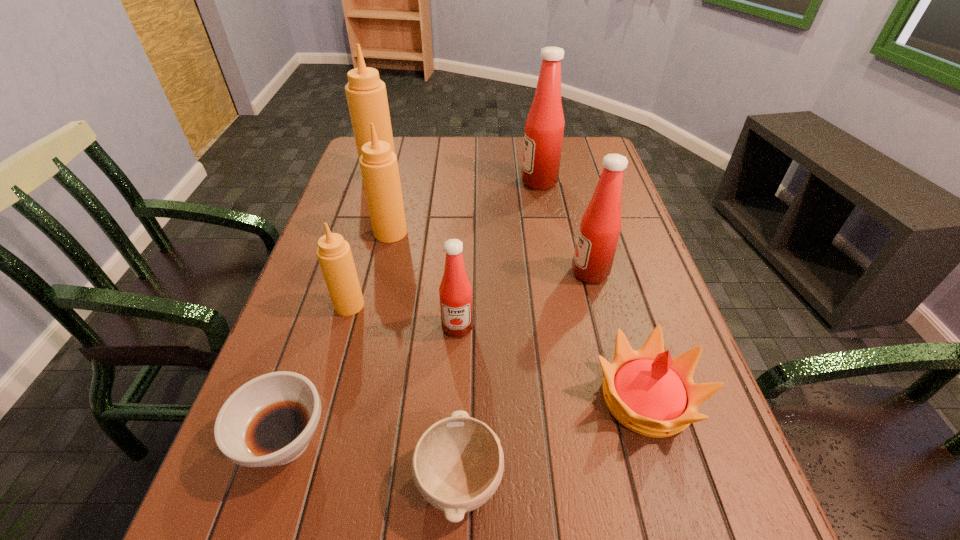
Locate an element on the screen. The width and height of the screenshot is (960, 540). vacant point located between the farthest tan condiment and the leftmost red condiment is located at coordinates (419, 251).

At what (x,y) coordinates should I click in order to perform the action: click on free space between the biggest red condiment and the beige bowl. Please return your answer as a coordinate pair (x, y). Image resolution: width=960 pixels, height=540 pixels. Looking at the image, I should click on (499, 330).

The width and height of the screenshot is (960, 540). What are the coordinates of `vacant area that lies between the beige bowl and the second farthest tan condiment` in the screenshot? It's located at (425, 356).

Find the location of a particular element. The image size is (960, 540). free space that is in between the farthest red condiment and the yellow crown is located at coordinates (x=592, y=290).

Where is `free point between the soup bowl and the second smallest red condiment`? free point between the soup bowl and the second smallest red condiment is located at coordinates (438, 356).

Identify which object is located as the fifth nearest to the farthest red condiment. Please provide its 2D coordinates. Your answer should be formatted as a tuple, i.e. [(x, y)], where the tuple contains the x and y coordinates of a point satisfying the conditions above.

[(334, 254)]

Where is `object that is the eighth nearest to the sixth nearest object`? object that is the eighth nearest to the sixth nearest object is located at coordinates (366, 94).

Where is `the closest condiment to the farthest red condiment`? the closest condiment to the farthest red condiment is located at coordinates (600, 227).

Choose which condiment is the third nearest neighbor to the nearest tan condiment. Please provide its 2D coordinates. Your answer should be formatted as a tuple, i.e. [(x, y)], where the tuple contains the x and y coordinates of a point satisfying the conditions above.

[(366, 94)]

You are a GUI agent. You are given a task and a screenshot of the screen. Output one action in this format:
    pyautogui.click(x=<x>, y=<y>)
    Task: Click on the red condiment that is the second closest to the biggest red condiment
    The image size is (960, 540).
    Given the screenshot: What is the action you would take?
    pyautogui.click(x=455, y=291)